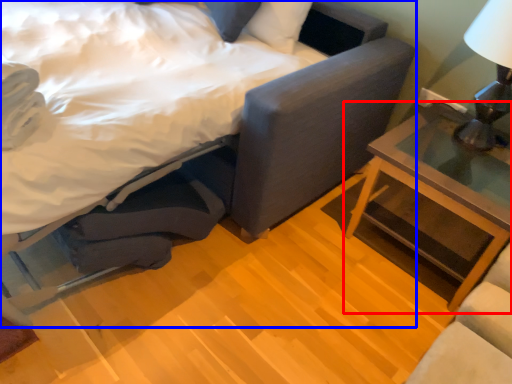
Question: Which of the following is the farthest to the observer, nightstand (highlighted by a red box) or bed (highlighted by a blue box)?

Choices:
 (A) nightstand
 (B) bed

Answer: (A)